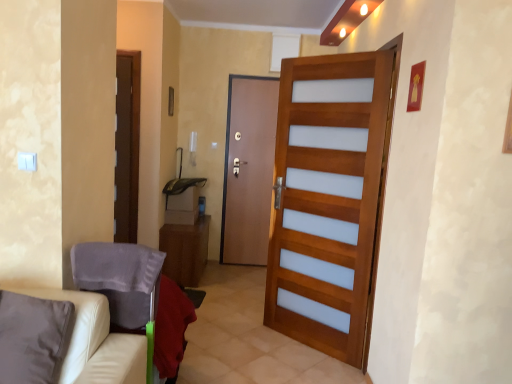
Locate an element on the screen. This screenshot has width=512, height=384. vacant region under brown wooden door at center, positioned as the 1th door in left-to-right order (from a real-world perspective) is located at coordinates 234,266.